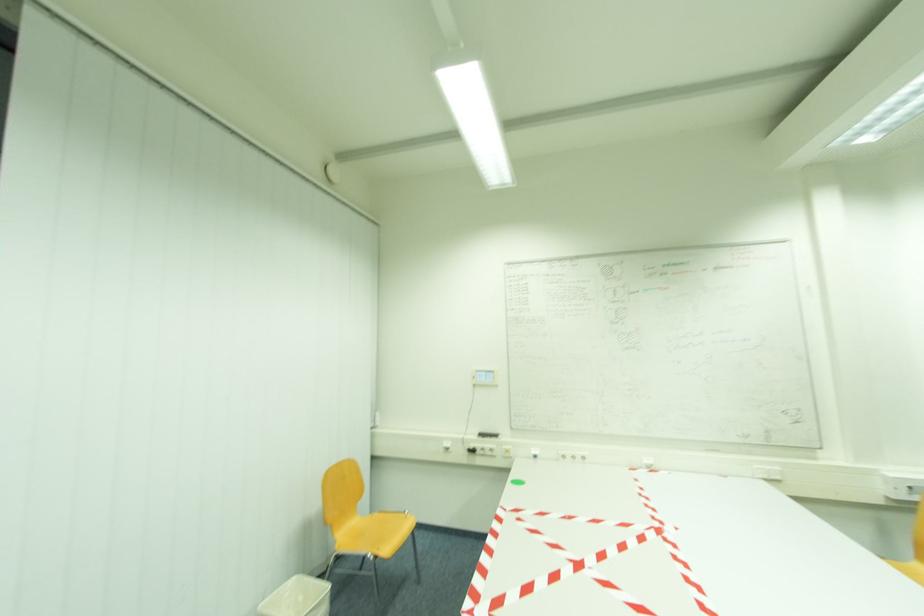
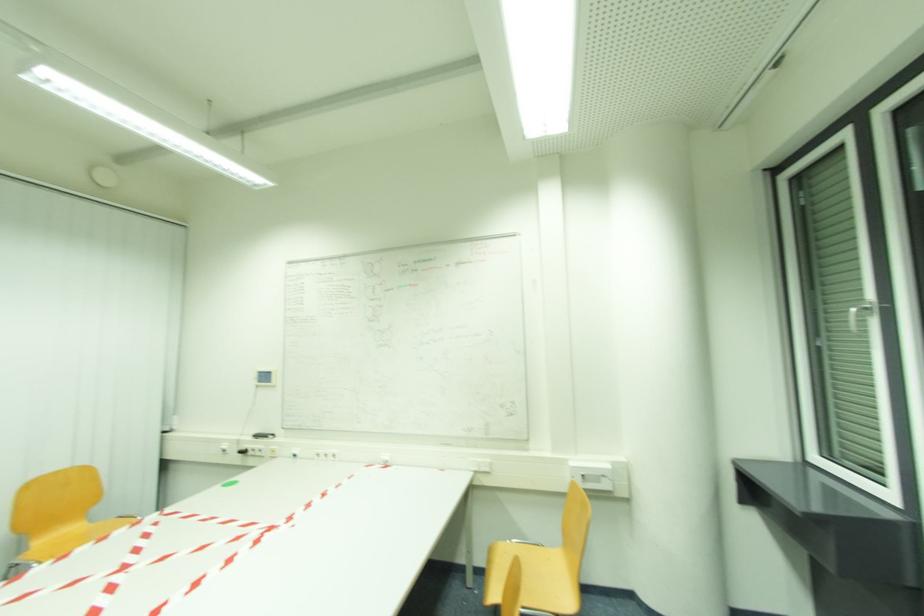
Question: Which direction would the cameraman need to move to produce the second image? Reply with the corresponding letter.

Choices:
 (A) Left
 (B) Right
 (C) Forward
 (D) Backward

Answer: (B)